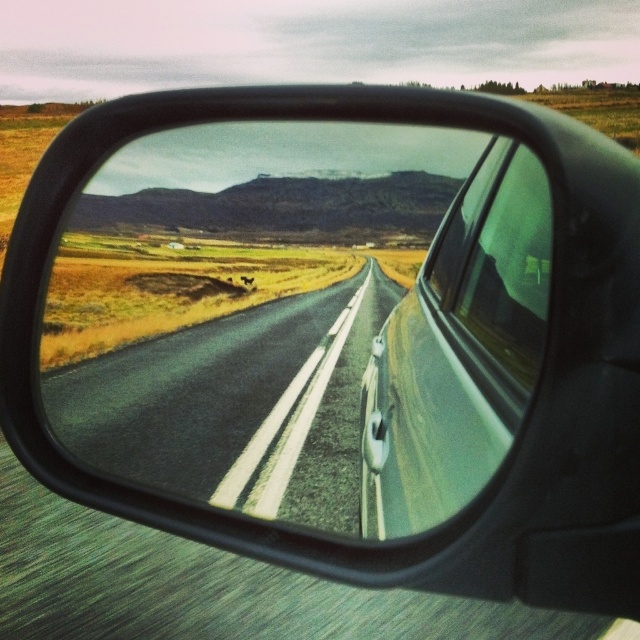
You are driving a car and notice the black glossy mirror at center and the asphalt road at center in your side mirror. Which object appears taller in the reflection?

The black glossy mirror at center appears taller than the asphalt road at center in the reflection.